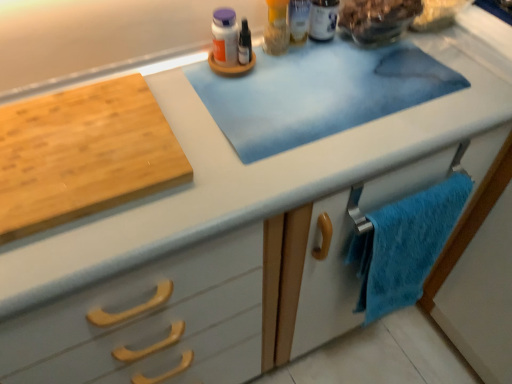
Question: From the image's perspective, is blue fuzzy towel at lower right located beneath white plastic bottle at upper center, marked as the 1th toiletry in a right-to-left arrangement?

Choices:
 (A) yes
 (B) no

Answer: (A)

Question: Does blue fuzzy towel at lower right have a larger size compared to white plastic bottle at upper center, marked as the 1th toiletry in a right-to-left arrangement?

Choices:
 (A) yes
 (B) no

Answer: (A)

Question: Is blue fuzzy towel at lower right outside of white plastic bottle at upper center, marked as the 1th toiletry in a right-to-left arrangement?

Choices:
 (A) no
 (B) yes

Answer: (B)

Question: Considering the relative sizes of blue fuzzy towel at lower right and white plastic bottle at upper center, which appears as the 2th toiletry when viewed from the left, in the image provided, is blue fuzzy towel at lower right smaller than white plastic bottle at upper center, which appears as the 2th toiletry when viewed from the left,?

Choices:
 (A) no
 (B) yes

Answer: (A)

Question: Is blue fuzzy towel at lower right to the left of white plastic bottle at upper center, which appears as the 2th toiletry when viewed from the left, from the viewer's perspective?

Choices:
 (A) no
 (B) yes

Answer: (A)

Question: From a real-world perspective, is translucent glass bowl at upper right physically located above or below blue fuzzy towel at lower right?

Choices:
 (A) below
 (B) above

Answer: (B)

Question: Is point (389, 13) closer or farther from the camera than point (389, 233)?

Choices:
 (A) closer
 (B) farther

Answer: (B)

Question: Is translucent glass bowl at upper right taller or shorter than blue fuzzy towel at lower right?

Choices:
 (A) short
 (B) tall

Answer: (A)

Question: Choose the correct answer: Is translucent glass bowl at upper right inside blue fuzzy towel at lower right or outside it?

Choices:
 (A) inside
 (B) outside

Answer: (B)

Question: Is point (313, 1) positioned closer to the camera than point (282, 46)?

Choices:
 (A) closer
 (B) farther

Answer: (A)

Question: Is white plastic bottle at upper center, which appears as the 2th toiletry when viewed from the left, in front of or behind translucent plastic container at upper center, placed as the 1th toiletry when sorted from left to right, in the image?

Choices:
 (A) front
 (B) behind

Answer: (B)

Question: Choose the correct answer: Is white plastic bottle at upper center, marked as the 1th toiletry in a right-to-left arrangement, inside translucent plastic container at upper center, arranged as the 2th toiletry when viewed from the right, or outside it?

Choices:
 (A) inside
 (B) outside

Answer: (B)

Question: Is white plastic bottle at upper center, which appears as the 2th toiletry when viewed from the left, to the left or to the right of translucent plastic container at upper center, placed as the 1th toiletry when sorted from left to right, in the image?

Choices:
 (A) right
 (B) left

Answer: (A)

Question: Considering the positions of natural wood cutting board at left and translucent glass bowl at upper right in the image, is natural wood cutting board at left taller or shorter than translucent glass bowl at upper right?

Choices:
 (A) tall
 (B) short

Answer: (B)

Question: Considering the relative positions of natural wood cutting board at left and translucent glass bowl at upper right in the image provided, is natural wood cutting board at left to the left or to the right of translucent glass bowl at upper right?

Choices:
 (A) right
 (B) left

Answer: (B)